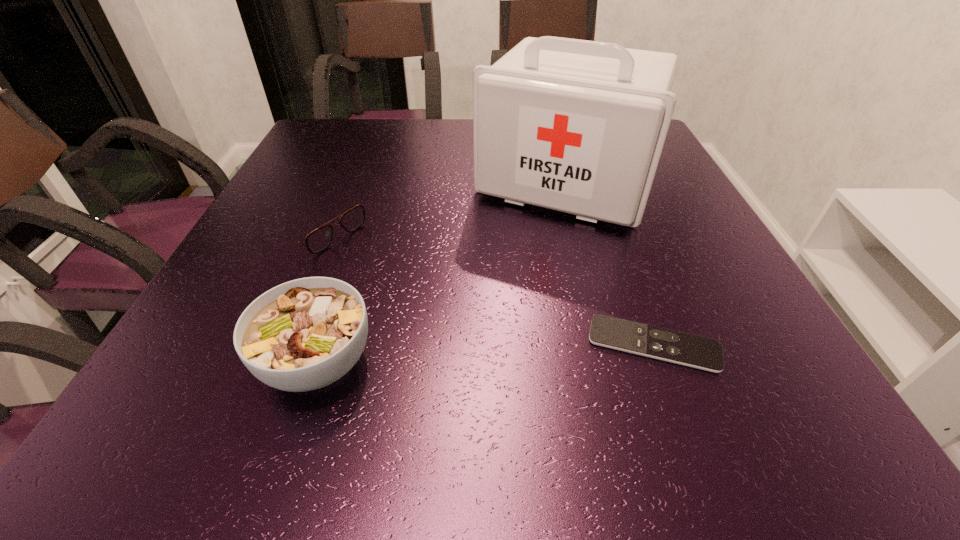
Identify the location of vacant space located on the front-facing side of the first-aid kit. (516, 266).

Where is `free region located on the front-facing side of the first-aid kit`? Image resolution: width=960 pixels, height=540 pixels. free region located on the front-facing side of the first-aid kit is located at coordinates (528, 245).

Locate an element on the screen. Image resolution: width=960 pixels, height=540 pixels. object that is at the far edge is located at coordinates (577, 126).

Locate an element on the screen. soup bowl situated at the near edge is located at coordinates (302, 335).

Image resolution: width=960 pixels, height=540 pixels. I want to click on remote control that is at the near edge, so click(x=704, y=353).

Find the location of a particular element. The width and height of the screenshot is (960, 540). soup bowl at the left edge is located at coordinates pos(302,335).

This screenshot has height=540, width=960. Find the location of `sunglasses present at the left edge`. sunglasses present at the left edge is located at coordinates (318, 240).

Where is `remote control at the right edge`? remote control at the right edge is located at coordinates (704, 353).

Where is `the first-aid kit situated at the right edge`? The image size is (960, 540). the first-aid kit situated at the right edge is located at coordinates (577, 126).

Where is `object located at the near left corner`? object located at the near left corner is located at coordinates (302, 335).